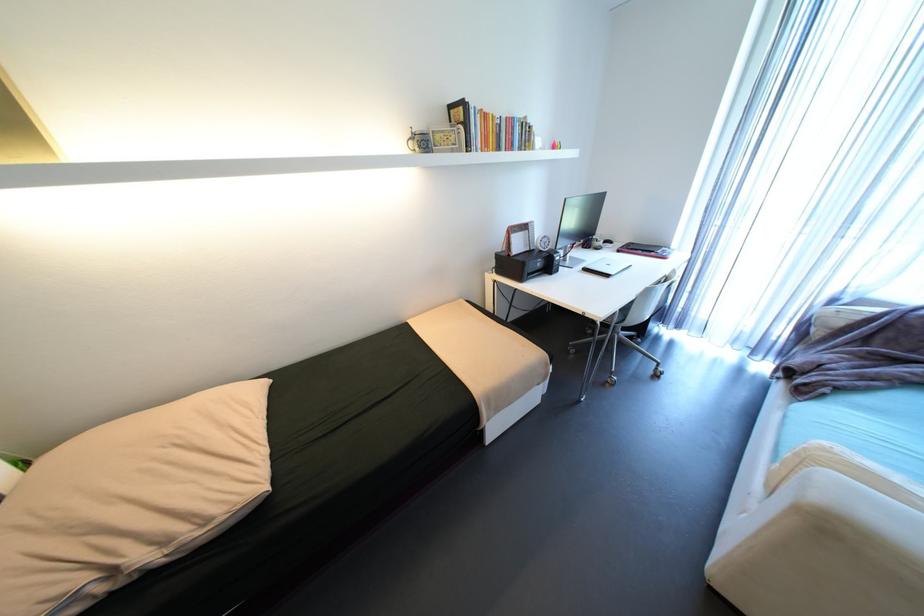
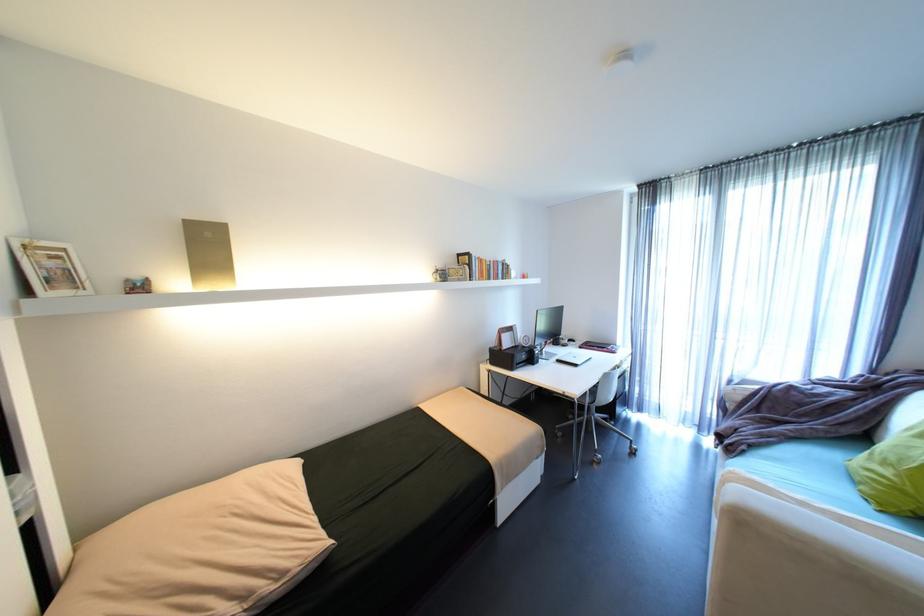
Locate, in the second image, the point that corresponds to the point at 419,128 in the first image.

(444, 267)